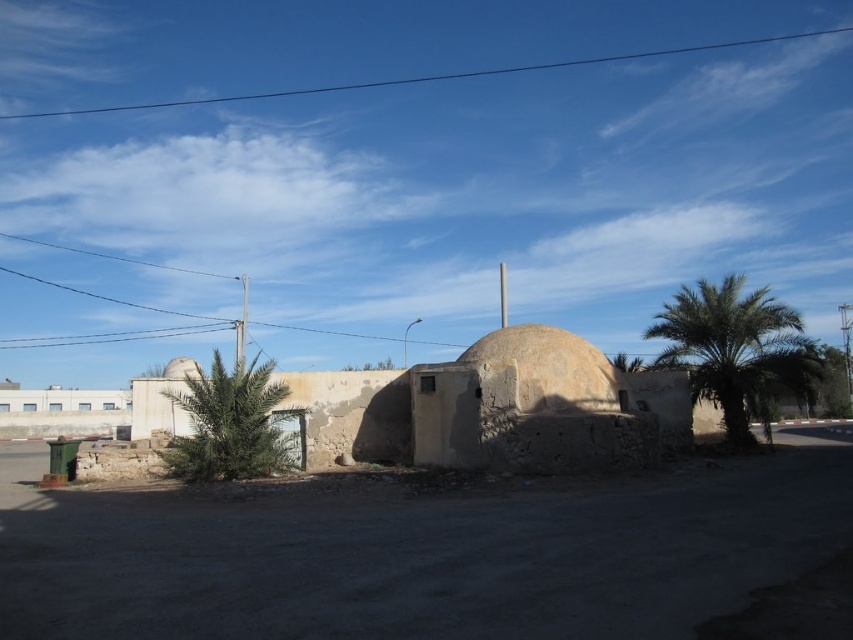
Consider the image. Between green leafy palm tree at center and smooth beige dome at center, which one is positioned higher?

Positioned higher is green leafy palm tree at center.

Does green leafy palm tree at center have a greater width compared to smooth beige dome at center?

In fact, green leafy palm tree at center might be narrower than smooth beige dome at center.

Is point (264, 448) positioned in front of point (165, 369)?

Yes, it is.

Locate an element on the screen. The image size is (853, 640). green leafy palm tree at center is located at coordinates (230, 422).

Which of these two, gray stone dome at center or smooth beige dome at center, stands taller?

With more height is smooth beige dome at center.

Does point (550, 365) lie behind point (178, 376)?

No.

Between point (590, 352) and point (184, 372), which one is positioned behind?

The point (184, 372) is behind.

You are a GUI agent. You are given a task and a screenshot of the screen. Output one action in this format:
    pyautogui.click(x=<x>, y=<y>)
    Task: Click on the gray stone dome at center
    The width and height of the screenshot is (853, 640).
    Given the screenshot: What is the action you would take?
    pyautogui.click(x=550, y=369)

Who is lower down, green leafy palm at right or smooth beige dome at center?

smooth beige dome at center

Looking at this image, which is more to the right, green leafy palm at right or smooth beige dome at center?

From the viewer's perspective, green leafy palm at right appears more on the right side.

At what (x,y) coordinates should I click in order to perform the action: click on green leafy palm at right. Please return your answer as a coordinate pair (x, y). Image resolution: width=853 pixels, height=640 pixels. Looking at the image, I should click on (735, 349).

Where is `green leafy palm at right`? The height and width of the screenshot is (640, 853). green leafy palm at right is located at coordinates (735, 349).